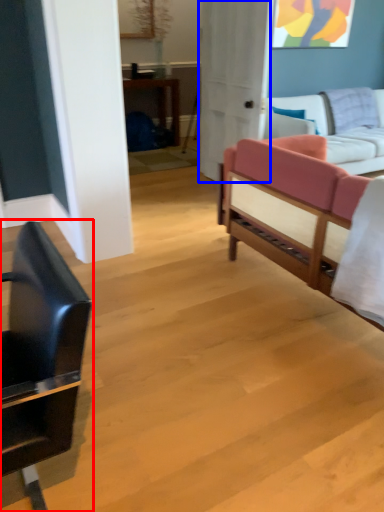
Question: Which point is closer to the camera, chair (highlighted by a red box) or glass door (highlighted by a blue box)?

Choices:
 (A) chair
 (B) glass door

Answer: (A)